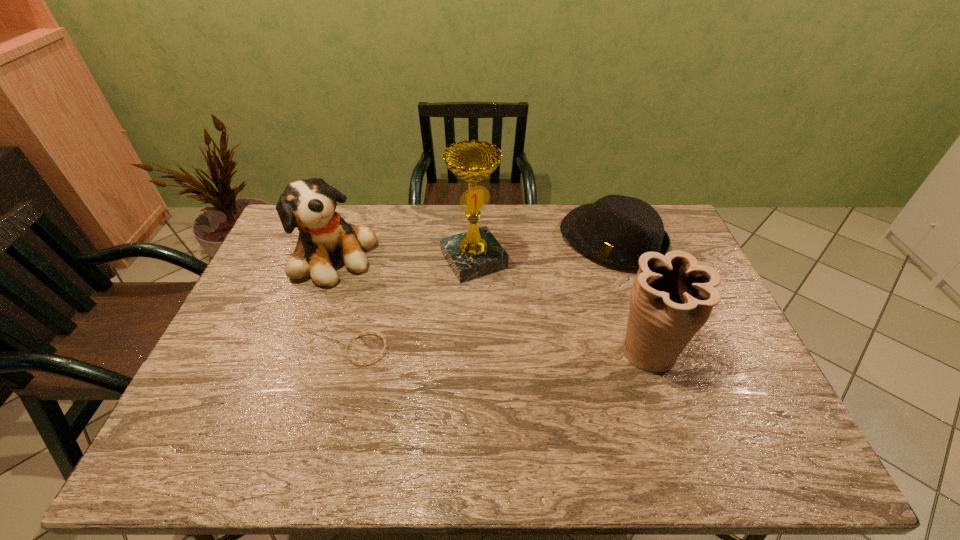
Locate an element on the screen. object that is the fourth closest to the shortest object is located at coordinates (672, 297).

Locate an element on the screen. vacant region that satisfies the following two spatial constraints: 1. on the front side of the puppy; 2. on the surface of the shortest object showing star-shaped elements is located at coordinates (302, 350).

Identify the location of free space that satisfies the following two spatial constraints: 1. on the front side of the urn; 2. on the right side of the third object from right to left. (472, 350).